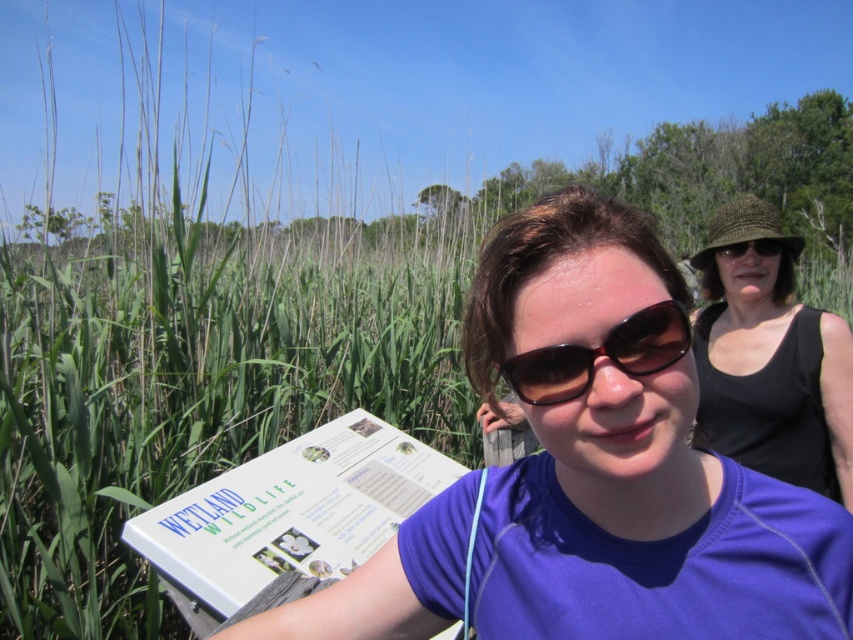
You are a photographer trying to capture a landscape photo of the scene described. You need to ensure that the purple fabric shirt at center is positioned exactly at the center of your camera frame. Given its current coordinates, do you need to adjust your camera to move the shirt to the center?

The purple fabric shirt at center is already positioned at point coordinates, so no adjustment is needed to center it in the frame.

You are a photographer trying to capture both the purple fabric shirt at center and the black knitted hat at upper right in the same frame. Based on their sizes in the image, which object should you focus on first to ensure both are in focus?

The purple fabric shirt at center is not as tall as the black knitted hat at upper right, so you should focus on the black knitted hat at upper right first since it is larger in the frame and will require more precise focusing to ensure both are in focus.

You are a photographer trying to capture a clear shot of the black knitted hat at upper right and the matte brown sunglasses at upper right. Since both are in the upper right corner, which one would appear larger in your photo?

The black knitted hat at upper right is closer to the viewer than the matte brown sunglasses at upper right, so it would appear larger in the photo.